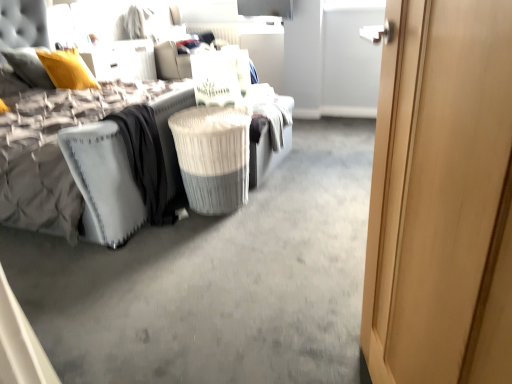
Question: Does point (207, 144) appear closer or farther from the camera than point (100, 162)?

Choices:
 (A) closer
 (B) farther

Answer: (B)

Question: Is white wicker laundry basket at center situated inside white textured mattress at left or outside?

Choices:
 (A) inside
 (B) outside

Answer: (B)

Question: Which object is positioned farthest from the light wood door at right?

Choices:
 (A) velvet grey bed at center
 (B) white textured mattress at left
 (C) white wicker laundry basket at center

Answer: (A)

Question: Which object is the closest to the white wicker laundry basket at center?

Choices:
 (A) light wood door at right
 (B) velvet grey bed at center
 (C) white textured mattress at left

Answer: (B)